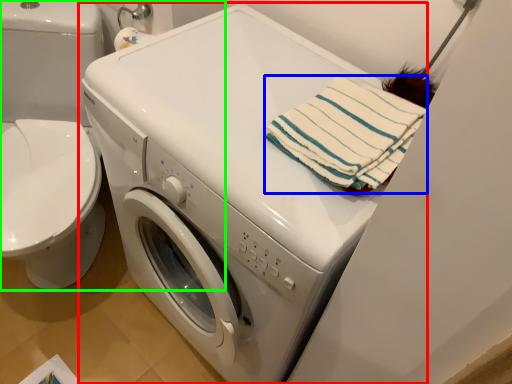
Question: Which object is the farthest from washing machine (highlighted by a red box)? Choose among these: beach towel (highlighted by a blue box) or washer (highlighted by a green box).

Choices:
 (A) beach towel
 (B) washer

Answer: (B)